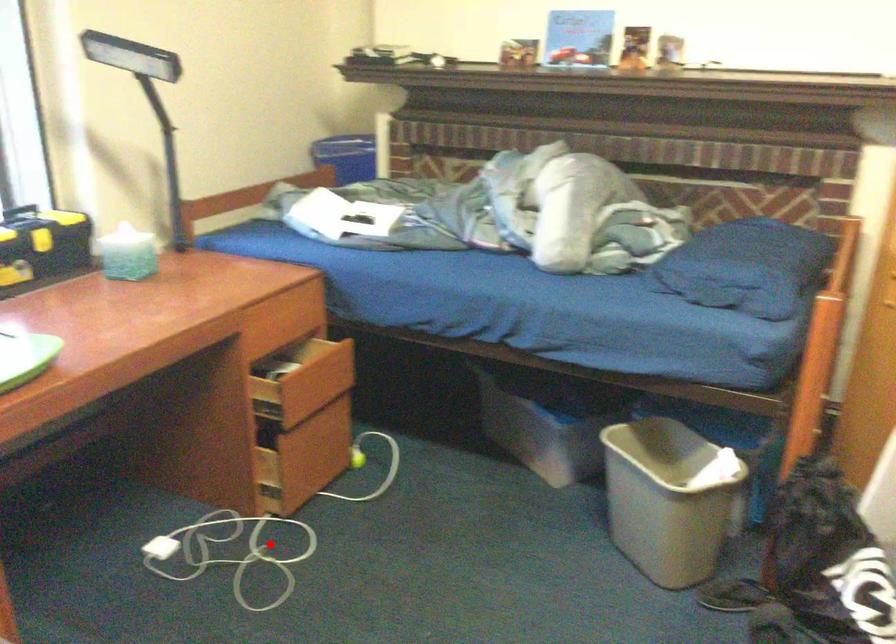
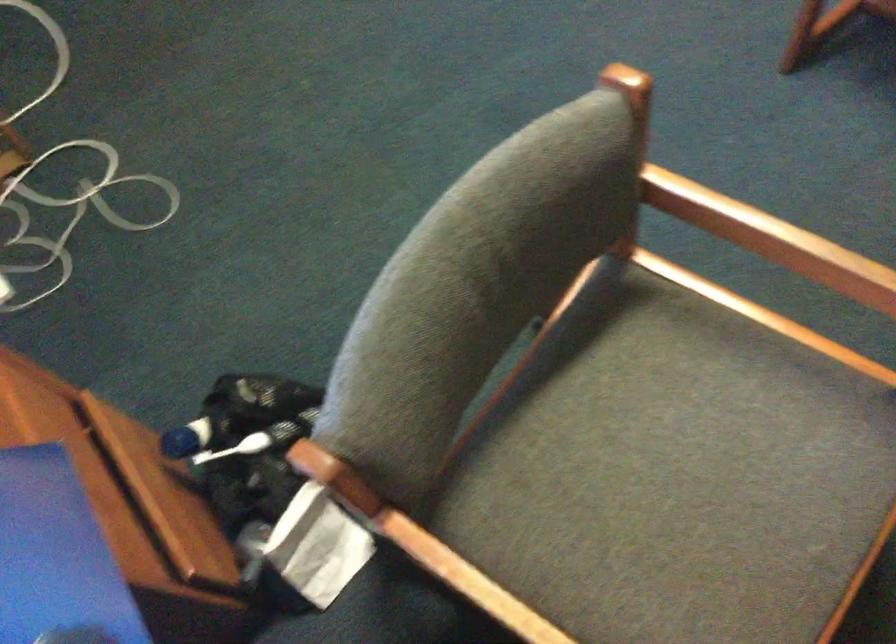
Question: I am providing you with two images of the same scene from different viewpoints. Given a red point in image1, look at the same physical point in image2. Is it:

Choices:
 (A) Closer to the viewpoint
 (B) Farther from the viewpoint

Answer: (A)